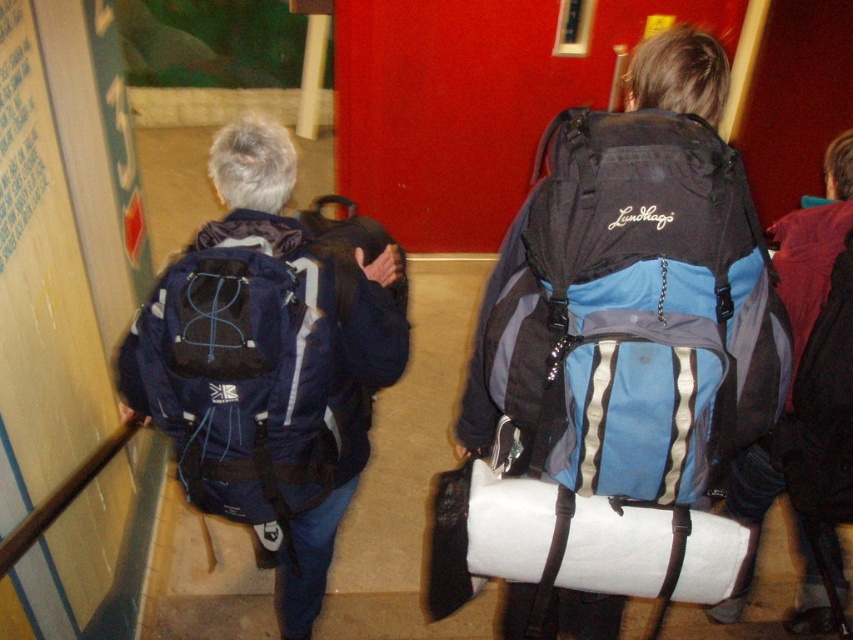
Consider the image. You are standing at the bottom of the staircase and see the matte blue backpack at left and the dark blue backpack with white accents. Which backpack is closer to the top of the staircase?

The dark blue backpack with white accents is closer to the top of the staircase because the matte blue backpack at left is located at point (267,364), which is lower on the staircase.

You are a delivery person who needs to carry both the matte blue backpack at left and the blue fabric backpack at center up the stairs. Given that the staircase has a beige carpet, which backpack will require more physical effort to carry?

The matte blue backpack at left requires more physical effort to carry because it is larger in size than the blue fabric backpack at center.